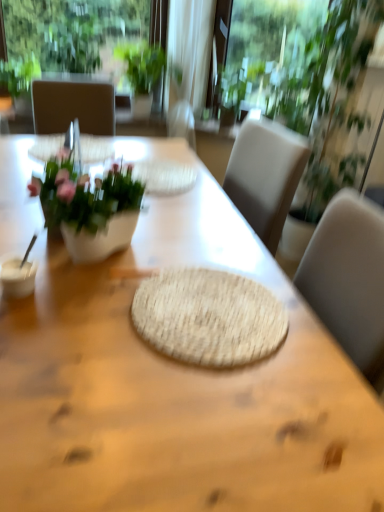
Question: From the image's perspective, is green leafy plant at upper center, which is the second houseplant from right to left, beneath green leafy plant at upper right, which is the third houseplant in left-to-right order?

Choices:
 (A) yes
 (B) no

Answer: (B)

Question: Is green leafy plant at upper center, which is the second houseplant from right to left, smaller than green leafy plant at upper right, positioned as the 1th houseplant in right-to-left order?

Choices:
 (A) yes
 (B) no

Answer: (B)

Question: Can you confirm if green leafy plant at upper center, acting as the second houseplant starting from the left, is taller than green leafy plant at upper right, positioned as the 1th houseplant in right-to-left order?

Choices:
 (A) no
 (B) yes

Answer: (A)

Question: Is green leafy plant at upper center, acting as the second houseplant starting from the left, positioned before green leafy plant at upper right, which is the third houseplant in left-to-right order?

Choices:
 (A) yes
 (B) no

Answer: (B)

Question: Does green leafy plant at upper center, which is the second houseplant from right to left, touch green leafy plant at upper right, which is the third houseplant in left-to-right order?

Choices:
 (A) yes
 (B) no

Answer: (B)

Question: Considering the relative sizes of green leafy plant at upper center, which is the second houseplant from right to left, and green leafy plant at upper right, which is the third houseplant in left-to-right order, in the image provided, is green leafy plant at upper center, which is the second houseplant from right to left, wider than green leafy plant at upper right, which is the third houseplant in left-to-right order,?

Choices:
 (A) no
 (B) yes

Answer: (B)

Question: Is white glossy vase at left facing towards natural woven mat at center?

Choices:
 (A) yes
 (B) no

Answer: (B)

Question: From a real-world perspective, is white glossy vase at left over natural woven mat at center?

Choices:
 (A) yes
 (B) no

Answer: (A)

Question: Considering the relative sizes of white glossy vase at left and natural woven mat at center in the image provided, is white glossy vase at left shorter than natural woven mat at center?

Choices:
 (A) no
 (B) yes

Answer: (A)

Question: From the image's perspective, does white glossy vase at left appear higher than natural woven mat at center?

Choices:
 (A) yes
 (B) no

Answer: (A)

Question: Is white glossy vase at left positioned in front of natural woven mat at center?

Choices:
 (A) yes
 (B) no

Answer: (B)

Question: Does white glossy vase at left appear on the left side of natural woven mat at center?

Choices:
 (A) yes
 (B) no

Answer: (A)

Question: Can you confirm if natural woven placemat at center is bigger than natural woven mat at center?

Choices:
 (A) yes
 (B) no

Answer: (A)